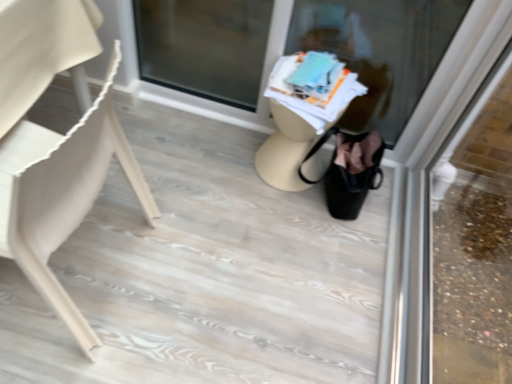
Question: Does translucent glass at center, the 2th shop window in the right-to-left sequence, lie behind beige matte table at center?

Choices:
 (A) no
 (B) yes

Answer: (A)

Question: From a real-world perspective, is translucent glass at center, the first shop window viewed from the left, positioned over beige matte table at center based on gravity?

Choices:
 (A) yes
 (B) no

Answer: (A)

Question: Can you confirm if translucent glass at center, the 2th shop window in the right-to-left sequence, is positioned to the left of beige matte table at center?

Choices:
 (A) no
 (B) yes

Answer: (B)

Question: From a real-world perspective, does translucent glass at center, the first shop window viewed from the left, sit lower than beige matte table at center?

Choices:
 (A) yes
 (B) no

Answer: (B)

Question: From the image's perspective, is translucent glass at center, the first shop window viewed from the left, located beneath beige matte table at center?

Choices:
 (A) no
 (B) yes

Answer: (A)

Question: Considering the positions of beige matte table at center and transparent glass door at upper right, the 2th shop window from the left, in the image, is beige matte table at center bigger or smaller than transparent glass door at upper right, the 2th shop window from the left,?

Choices:
 (A) big
 (B) small

Answer: (B)

Question: Is point (295, 147) closer or farther from the camera than point (502, 62)?

Choices:
 (A) farther
 (B) closer

Answer: (A)

Question: From a real-world perspective, is beige matte table at center positioned above or below transparent glass door at upper right, marked as the first shop window in a right-to-left arrangement?

Choices:
 (A) below
 (B) above

Answer: (A)

Question: Based on their positions, is beige matte table at center located to the left or right of transparent glass door at upper right, the 2th shop window from the left?

Choices:
 (A) left
 (B) right

Answer: (A)

Question: Considering the positions of translucent glass at center, the first shop window viewed from the left, and transparent glass door at upper right, the 2th shop window from the left, in the image, is translucent glass at center, the first shop window viewed from the left, bigger or smaller than transparent glass door at upper right, the 2th shop window from the left,?

Choices:
 (A) big
 (B) small

Answer: (A)

Question: Is translucent glass at center, the 2th shop window in the right-to-left sequence, to the left or to the right of transparent glass door at upper right, marked as the first shop window in a right-to-left arrangement, in the image?

Choices:
 (A) right
 (B) left

Answer: (B)

Question: Is translucent glass at center, the first shop window viewed from the left, wider or thinner than transparent glass door at upper right, the 2th shop window from the left?

Choices:
 (A) thin
 (B) wide

Answer: (B)

Question: Is translucent glass at center, the first shop window viewed from the left, in front of or behind transparent glass door at upper right, the 2th shop window from the left, in the image?

Choices:
 (A) behind
 (B) front

Answer: (A)

Question: Does point (439, 288) appear closer or farther from the camera than point (60, 205)?

Choices:
 (A) closer
 (B) farther

Answer: (B)

Question: Considering the relative positions of transparent glass door at upper right, the 2th shop window from the left, and matte beige chair at left in the image provided, is transparent glass door at upper right, the 2th shop window from the left, to the left or to the right of matte beige chair at left?

Choices:
 (A) left
 (B) right

Answer: (B)